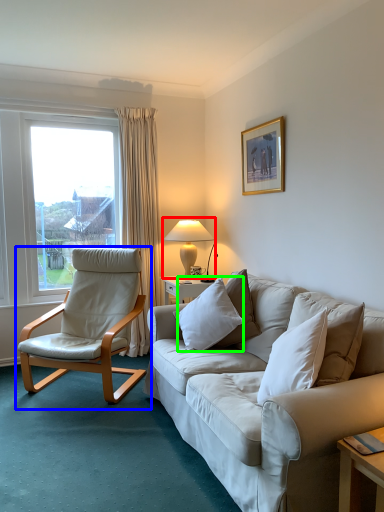
Question: Which is farther away from table lamp (highlighted by a red box)? chair (highlighted by a blue box) or pillow (highlighted by a green box)?

Choices:
 (A) chair
 (B) pillow

Answer: (B)